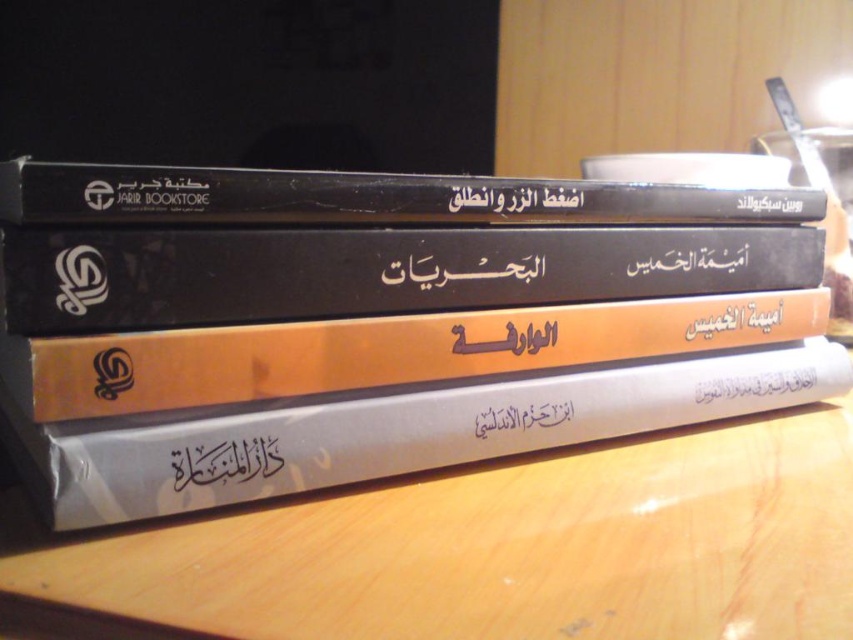
Does matte black book at center lie behind white paper at upper center?

No, it is in front of white paper at upper center.

Between matte black book at center and white paper at upper center, which one is positioned lower?

matte black book at center

The width and height of the screenshot is (853, 640). What do you see at coordinates (379, 321) in the screenshot?
I see `matte black book at center` at bounding box center [379, 321].

Find the location of a particular element. matte black book at center is located at coordinates (379, 321).

Is black calligraphy at center above white paper at upper center?

Incorrect, black calligraphy at center is not positioned above white paper at upper center.

This screenshot has height=640, width=853. In order to click on black calligraphy at center in this screenshot , I will do `click(225, 461)`.

Between point (229, 442) and point (762, 205), which one is positioned behind?

Positioned behind is point (762, 205).

This screenshot has height=640, width=853. I want to click on black calligraphy at center, so click(225, 461).

Does white paper at center appear under black matte book at upper center?

Yes.

Who is shorter, white paper at center or black matte book at upper center?

white paper at center is shorter.

Where is `white paper at center`? This screenshot has width=853, height=640. white paper at center is located at coordinates (489, 548).